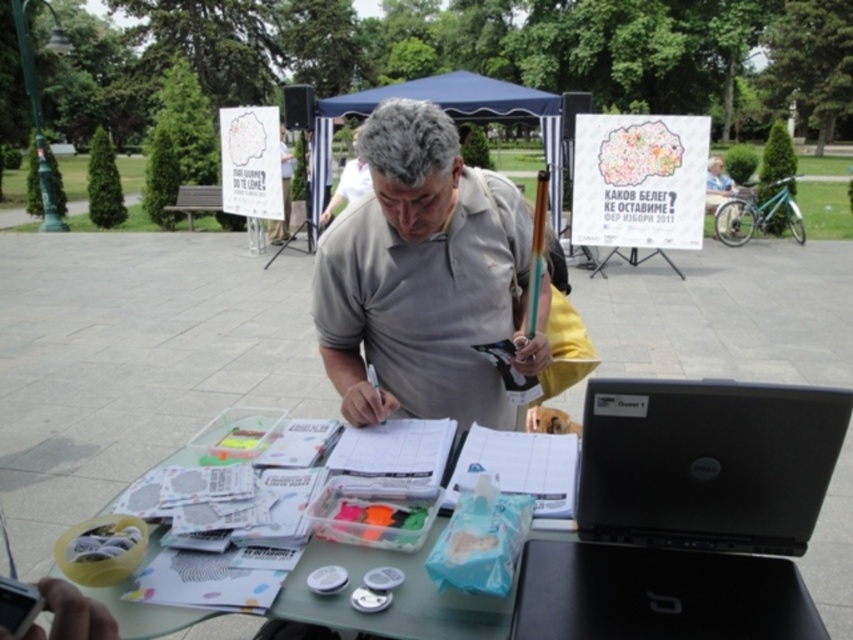
Between point (706, 416) and point (427, 168), which one is positioned in front?

Point (706, 416) is in front.

Between point (695, 476) and point (465, 236), which one is positioned behind?

Positioned behind is point (465, 236).

This screenshot has width=853, height=640. What are the coordinates of `black plastic laptop at center` in the screenshot? It's located at (688, 515).

Is black plastic laptop at center shorter than clear plastic table at center?

No, black plastic laptop at center is not shorter than clear plastic table at center.

You are a GUI agent. You are given a task and a screenshot of the screen. Output one action in this format:
    pyautogui.click(x=<x>, y=<y>)
    Task: Click on the black plastic laptop at center
    The height and width of the screenshot is (640, 853).
    Given the screenshot: What is the action you would take?
    pyautogui.click(x=688, y=515)

Can you confirm if gray matte shirt at center is wider than clear plastic table at center?

No, gray matte shirt at center is not wider than clear plastic table at center.

Does gray matte shirt at center appear over clear plastic table at center?

Correct, gray matte shirt at center is located above clear plastic table at center.

The image size is (853, 640). What do you see at coordinates (424, 278) in the screenshot?
I see `gray matte shirt at center` at bounding box center [424, 278].

Identify the location of gray matte shirt at center. This screenshot has height=640, width=853. (424, 278).